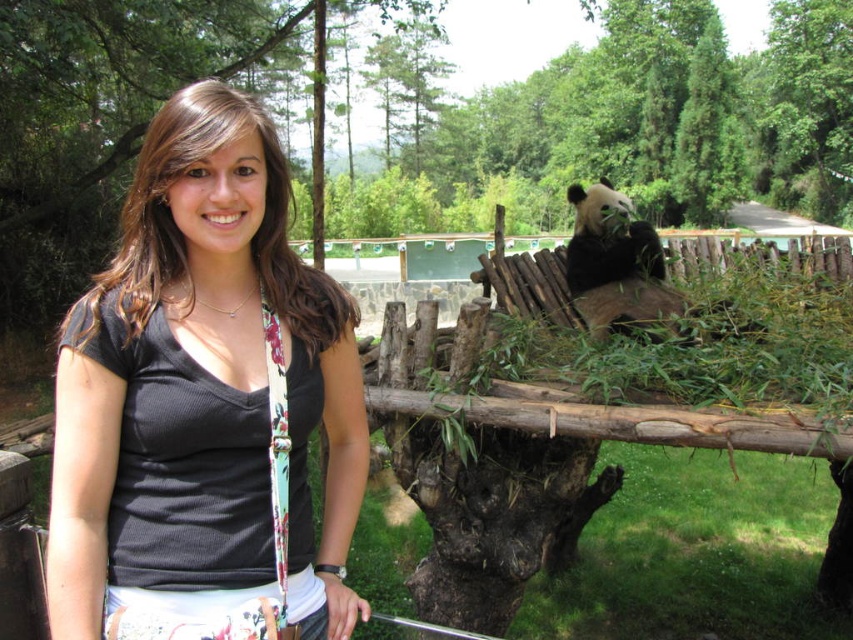
Question: Which point is farther to the camera?

Choices:
 (A) black fuzzy panda at upper right
 (B) black fabric shirt at center

Answer: (A)

Question: Is the position of black fabric shirt at center less distant than that of black fuzzy panda at upper right?

Choices:
 (A) no
 (B) yes

Answer: (B)

Question: Does black fabric shirt at center have a lesser width compared to black fuzzy panda at upper right?

Choices:
 (A) no
 (B) yes

Answer: (B)

Question: Does black fabric shirt at center appear under black fuzzy panda at upper right?

Choices:
 (A) no
 (B) yes

Answer: (B)